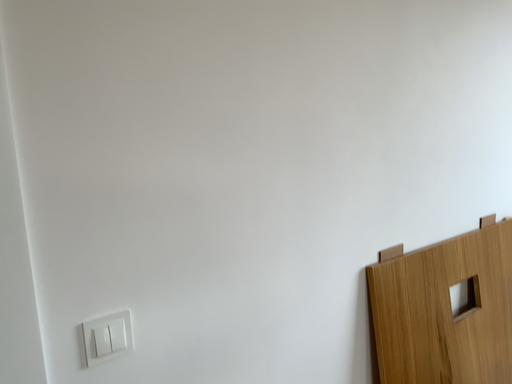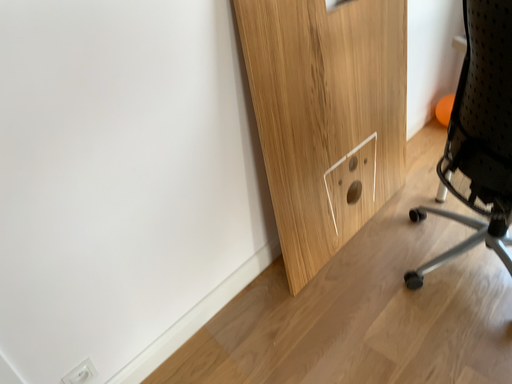
Question: Which way did the camera rotate in the video?

Choices:
 (A) rotated downward
 (B) rotated upward

Answer: (A)